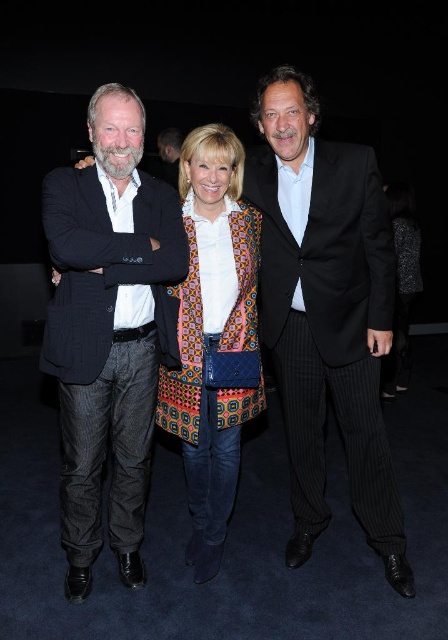
Question: Which of the following is the closest to the observer?

Choices:
 (A) patterned fabric coat at center
 (B) dark blue pinstripe suit at left
 (C) black pinstripe suit at center

Answer: (B)

Question: Among these points, which one is farthest from the camera?

Choices:
 (A) (197, 472)
 (B) (253, 182)

Answer: (A)

Question: Which point appears farthest from the camera in this image?

Choices:
 (A) (89, 364)
 (B) (250, 400)
 (C) (301, 308)

Answer: (B)

Question: Can you confirm if black pinstripe suit at center is positioned to the left of dark blue pinstripe suit at left?

Choices:
 (A) yes
 (B) no

Answer: (B)

Question: Does black pinstripe suit at center have a larger size compared to patterned fabric coat at center?

Choices:
 (A) yes
 (B) no

Answer: (A)

Question: Is the position of black pinstripe suit at center less distant than that of dark blue pinstripe suit at left?

Choices:
 (A) yes
 (B) no

Answer: (B)